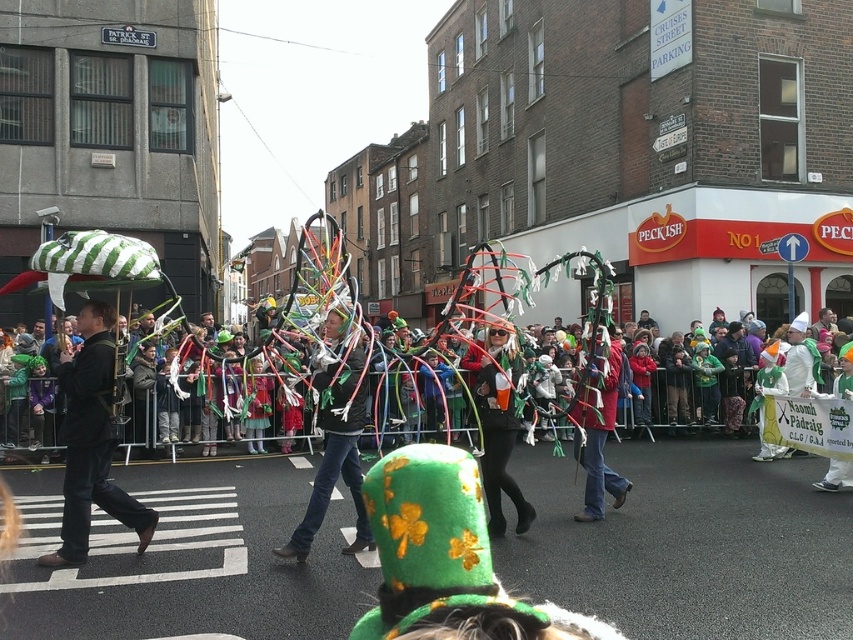
Consider the image. You are a parade participant standing at the front of the group. You need to pass a small gift to someone holding the green felt hat at center without letting the person with the green fabric hat at center see it. Can you do this while staying within 4 feet of your current position?

The green fabric hat at center is 3.81 feet away from the green felt hat at center. Since you need to stay within 4 feet of your current position, you can move towards the green felt hat at center and pass the gift while keeping the green fabric hat at center out of sight, as the distance allows it.

You are standing at the point labeled as point (335, 452) in the image. What object are you currently standing on?

You are standing on the green fabric hat at center.

You are a photographer standing at the edge of the parade crowd. You want to take a photo that includes both the matte black jacket at left and the green fabric hat at center. Given that your camera has a maximum focus range of 4 feet, will both subjects be in focus?

The distance between the matte black jacket at left and the green fabric hat at center is 4.68 feet. Since the camera can only focus within 4 feet, the subjects are too far apart for both to be in focus simultaneously.